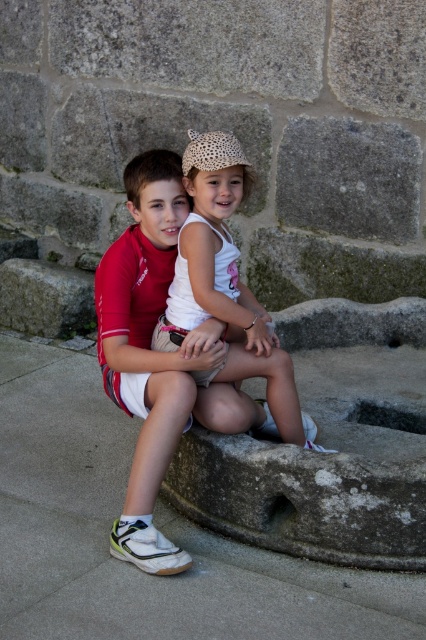
Which is more to the right, matte white shirt at center or white cotton shirt at center?

white cotton shirt at center is more to the right.

Can you confirm if matte white shirt at center is positioned below white cotton shirt at center?

Correct, matte white shirt at center is located below white cotton shirt at center.

Who is more forward, (241, 349) or (249, 369)?

Point (249, 369)

Where is `matte white shirt at center`? Image resolution: width=426 pixels, height=640 pixels. matte white shirt at center is located at coordinates (169, 358).

Can you confirm if matte white shirt at center is smaller than green rough stone at center?

Actually, matte white shirt at center might be larger than green rough stone at center.

Can you confirm if matte white shirt at center is wider than green rough stone at center?

Indeed, matte white shirt at center has a greater width compared to green rough stone at center.

This screenshot has width=426, height=640. Find the location of `matte white shirt at center`. matte white shirt at center is located at coordinates (169, 358).

At what (x,y) coordinates should I click in order to perform the action: click on matte white shirt at center. Please return your answer as a coordinate pair (x, y). Looking at the image, I should click on (169, 358).

Can you confirm if gray rough stone at center is bigger than green rough stone at center?

Yes, gray rough stone at center is bigger than green rough stone at center.

Is gray rough stone at center thinner than green rough stone at center?

No, gray rough stone at center is not thinner than green rough stone at center.

The image size is (426, 640). In order to click on gray rough stone at center in this screenshot , I will do `click(348, 177)`.